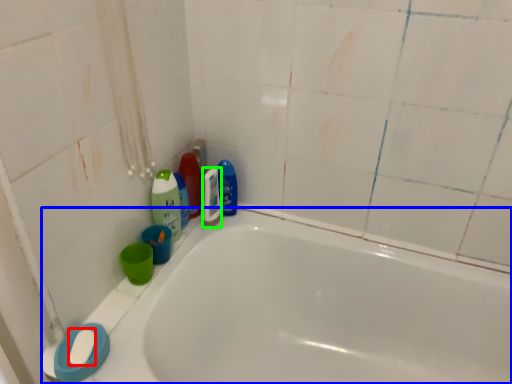
Question: Which object is the closest to the soap (highlighted by a red box)? Choose among these: bathtub (highlighted by a blue box) or mouthwash (highlighted by a green box).

Choices:
 (A) bathtub
 (B) mouthwash

Answer: (B)